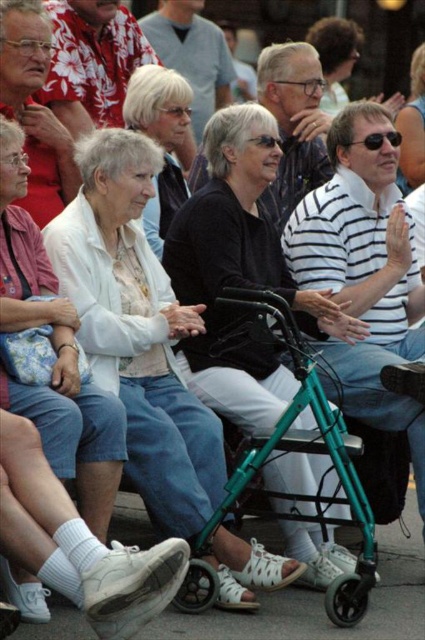
You are a photographer trying to capture a candid shot of the matte black sunglasses at upper center without the white matte walker at center obstructing the view. Given the distance between them, do you think you can position yourself to take the photo without the walker blocking the sunglasses?

The white matte walker at center and matte black sunglasses at upper center are 32.22 meters apart, so yes, you can position yourself to take the photo without the walker blocking the sunglasses since the distance is sufficient to avoid obstruction.

You are a photographer trying to capture a clear shot of both the white matte walker at center and the black fabric walker at center. Since both are in the center, how can you position your camera to ensure both are visible in the frame?

The white matte walker at center is below the black fabric walker at center, so positioning the camera slightly above the white matte walker at center would allow both to be captured in the frame.

You are a photographer at the event and want to capture a photo that includes both the white matte shirt at center and the matte black sunglasses at upper center. Based on their positions, which object should you focus on first to ensure both are in the frame?

The white matte shirt at center is positioned on the left side of matte black sunglasses at upper center, so you should focus on the white matte shirt at center first to ensure both are included in the frame.